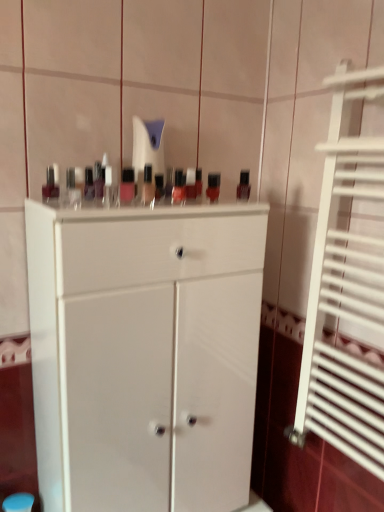
The image size is (384, 512). What do you see at coordinates (347, 283) in the screenshot?
I see `white metal radiator at right` at bounding box center [347, 283].

Find the location of a particular element. This screenshot has width=384, height=512. white metal radiator at right is located at coordinates (347, 283).

Find the location of `matte black nail polish at upper center, placed as the 3th mouthwash when sorted from front to back`. matte black nail polish at upper center, placed as the 3th mouthwash when sorted from front to back is located at coordinates (244, 185).

What is the approximate height of matte black nail polish at upper center, placed as the 3th mouthwash when sorted from front to back?

matte black nail polish at upper center, placed as the 3th mouthwash when sorted from front to back, is 4.04 inches tall.

Locate an element on the screen. Image resolution: width=384 pixels, height=512 pixels. matte black nail polish at upper left, arranged as the 2th toiletry when viewed from the front is located at coordinates (100, 176).

Would you say matte plastic mouthwash at center, arranged as the 2th mouthwash when viewed from the back, is part of matte plastic nail polish bottles at center, the 1th toiletry positioned from the front,'s contents?

Definitely not — matte plastic mouthwash at center, arranged as the 2th mouthwash when viewed from the back, is not inside matte plastic nail polish bottles at center, the 1th toiletry positioned from the front.

From a real-world perspective, which object stands above the other?

matte plastic nail polish bottles at center, the 1th toiletry positioned from the front, is physically above.

Does matte plastic nail polish bottles at center, the second toiletry viewed from the back, have a lesser height compared to matte plastic mouthwash at center, marked as the 2th mouthwash in a front-to-back arrangement?

Yes, matte plastic nail polish bottles at center, the second toiletry viewed from the back, is shorter than matte plastic mouthwash at center, marked as the 2th mouthwash in a front-to-back arrangement.

Considering the positions of objects matte black nail polish at upper center, which appears as the first mouthwash when viewed from the back, and white matte cabinet at center in the image provided, who is more to the right, matte black nail polish at upper center, which appears as the first mouthwash when viewed from the back, or white matte cabinet at center?

matte black nail polish at upper center, which appears as the first mouthwash when viewed from the back.

Is point (244, 174) farther from viewer compared to point (227, 351)?

Yes, it is.

Considering the sizes of objects matte black nail polish at upper center, placed as the 3th mouthwash when sorted from front to back, and white matte cabinet at center in the image provided, who is smaller, matte black nail polish at upper center, placed as the 3th mouthwash when sorted from front to back, or white matte cabinet at center?

With smaller size is matte black nail polish at upper center, placed as the 3th mouthwash when sorted from front to back.

From the image's perspective, does matte black nail polish at upper center, placed as the 3th mouthwash when sorted from front to back, appear higher than white matte cabinet at center?

Indeed, from the image's perspective, matte black nail polish at upper center, placed as the 3th mouthwash when sorted from front to back, is shown above white matte cabinet at center.

Is matte black bottle at left, the third mouthwash when ordered from right to left, located within white matte cabinet at center?

No, matte black bottle at left, the third mouthwash when ordered from right to left, is located outside of white matte cabinet at center.

In the image, is white matte cabinet at center on the left side or the right side of matte black bottle at left, the third mouthwash when ordered from right to left?

From the image, it's evident that white matte cabinet at center is to the right of matte black bottle at left, the third mouthwash when ordered from right to left.

From the image's perspective, is white matte cabinet at center below matte black bottle at left, marked as the first mouthwash in a left-to-right arrangement?

Yes.

Is white matte cabinet at center facing away from matte black bottle at left, which is the 3th mouthwash from back to front?

No, white matte cabinet at center is not facing the opposite direction of matte black bottle at left, which is the 3th mouthwash from back to front.

The height and width of the screenshot is (512, 384). What are the coordinates of `shutter located in front of the matte black nail polish at upper center, marked as the first mouthwash in a right-to-left arrangement` in the screenshot? It's located at (347, 283).

Does matte black nail polish at upper center, placed as the 3th mouthwash when sorted from front to back, have a lesser width compared to white metal radiator at right?

Correct, the width of matte black nail polish at upper center, placed as the 3th mouthwash when sorted from front to back, is less than that of white metal radiator at right.

Is matte black nail polish at upper center, marked as the first mouthwash in a right-to-left arrangement, positioned with its back to white metal radiator at right?

That's not correct — matte black nail polish at upper center, marked as the first mouthwash in a right-to-left arrangement, is not looking away from white metal radiator at right.

From a real-world perspective, count 2nd mouthwashs upward from the matte plastic mouthwash at center, which is counted as the second mouthwash, starting from the right, and point to it. Please provide its 2D coordinates.

[(51, 183)]

Is matte plastic mouthwash at center, arranged as the 2th mouthwash when viewed from the back, oriented away from matte black bottle at left, which is the 3th mouthwash from back to front?

matte plastic mouthwash at center, arranged as the 2th mouthwash when viewed from the back, does not have its back to matte black bottle at left, which is the 3th mouthwash from back to front.

Could matte black bottle at left, marked as the first mouthwash in a left-to-right arrangement, be considered to be inside matte plastic mouthwash at center, the second mouthwash when ordered from left to right?

No, matte black bottle at left, marked as the first mouthwash in a left-to-right arrangement, is not surrounded by matte plastic mouthwash at center, the second mouthwash when ordered from left to right.

Are matte plastic mouthwash at center, marked as the 2th mouthwash in a front-to-back arrangement, and matte black bottle at left, which is the 1th mouthwash in front-to-back order, beside each other?

matte plastic mouthwash at center, marked as the 2th mouthwash in a front-to-back arrangement, is not next to matte black bottle at left, which is the 1th mouthwash in front-to-back order, and they're not touching.

From a real-world perspective, between matte black nail polish at upper center, marked as the first mouthwash in a right-to-left arrangement, and matte black bottle at left, the third mouthwash when ordered from right to left, who is vertically lower?

matte black nail polish at upper center, marked as the first mouthwash in a right-to-left arrangement, is physically lower.

From a real-world perspective, count 1st mouthwashs downward from the matte black bottle at left, which is the 3th mouthwash from back to front, and point to it. Please provide its 2D coordinates.

[(244, 185)]

Considering the relative sizes of matte black nail polish at upper center, which appears as the first mouthwash when viewed from the back, and matte black bottle at left, which is the 1th mouthwash in front-to-back order, in the image provided, is matte black nail polish at upper center, which appears as the first mouthwash when viewed from the back, thinner than matte black bottle at left, which is the 1th mouthwash in front-to-back order,?

Indeed, matte black nail polish at upper center, which appears as the first mouthwash when viewed from the back, has a lesser width compared to matte black bottle at left, which is the 1th mouthwash in front-to-back order.

In the scene shown: Is matte black nail polish at upper left, arranged as the 1th toiletry when viewed from the back, positioned behind matte plastic nail polish bottles at center, the 1th toiletry positioned from the front?

Yes, matte black nail polish at upper left, arranged as the 1th toiletry when viewed from the back, is further from the camera.

Is point (100, 177) positioned after point (69, 172)?

That is False.

Is matte black nail polish at upper left, arranged as the 1th toiletry when viewed from the back, facing towards matte plastic nail polish bottles at center, the 1th toiletry positioned from the front?

No, matte black nail polish at upper left, arranged as the 1th toiletry when viewed from the back, does not turn towards matte plastic nail polish bottles at center, the 1th toiletry positioned from the front.

Is matte black nail polish at upper left, arranged as the 1th toiletry when viewed from the back, surrounding matte plastic nail polish bottles at center, the 1th toiletry positioned from the front?

No, matte plastic nail polish bottles at center, the 1th toiletry positioned from the front, is not a part of matte black nail polish at upper left, arranged as the 1th toiletry when viewed from the back.

The height and width of the screenshot is (512, 384). I want to click on mouthwash that is the 3rd object directly below the matte plastic nail polish bottles at center, the second toiletry viewed from the back (from a real-world perspective), so pyautogui.click(x=148, y=185).

Where is `mouthwash that is the 2nd object above the white matte cabinet at center (from a real-world perspective)`? mouthwash that is the 2nd object above the white matte cabinet at center (from a real-world perspective) is located at coordinates (244, 185).

Based on their spatial positions, is white matte cabinet at center or white metal radiator at right closer to matte black nail polish at upper center, placed as the 3th mouthwash when sorted from front to back?

white metal radiator at right lies closer to matte black nail polish at upper center, placed as the 3th mouthwash when sorted from front to back, than the other object.

Estimate the real-world distances between objects in this image. Which object is closer to white matte cabinet at center, matte black bottle at left, which is the 3th mouthwash from back to front, or white metal radiator at right?

white metal radiator at right.

When comparing their distances from white matte cabinet at center, does matte black nail polish at upper center, which appears as the first mouthwash when viewed from the back, or matte black bottle at left, which is the 3th mouthwash from back to front, seem further?

Based on the image, matte black nail polish at upper center, which appears as the first mouthwash when viewed from the back, appears to be further to white matte cabinet at center.

Looking at the image, which one is located further to matte plastic mouthwash at center, which is counted as the second mouthwash, starting from the right, white metal radiator at right or matte black nail polish at upper left, arranged as the 1th toiletry when viewed from the back?

Among the two, white metal radiator at right is located further to matte plastic mouthwash at center, which is counted as the second mouthwash, starting from the right.

Considering their positions, is white metal radiator at right positioned closer to matte black nail polish at upper center, which appears as the first mouthwash when viewed from the back, than matte plastic mouthwash at center, which is counted as the second mouthwash, starting from the right?

matte plastic mouthwash at center, which is counted as the second mouthwash, starting from the right, is positioned closer to the anchor matte black nail polish at upper center, which appears as the first mouthwash when viewed from the back.

Looking at the image, which one is located further to white matte cabinet at center, white metal radiator at right or matte black nail polish at upper center, placed as the 3th mouthwash when sorted from front to back?

The object further to white matte cabinet at center is matte black nail polish at upper center, placed as the 3th mouthwash when sorted from front to back.

When comparing their distances from matte black nail polish at upper left, arranged as the 2th toiletry when viewed from the front, does white matte cabinet at center or matte plastic nail polish bottles at center, the 1th toiletry positioned from the front, seem closer?

matte plastic nail polish bottles at center, the 1th toiletry positioned from the front, is closer to matte black nail polish at upper left, arranged as the 2th toiletry when viewed from the front.

Based on their spatial positions, is matte plastic mouthwash at center, which is counted as the second mouthwash, starting from the right, or matte black nail polish at upper left, arranged as the 1th toiletry when viewed from the back, further from white metal radiator at right?

Based on the image, matte black nail polish at upper left, arranged as the 1th toiletry when viewed from the back, appears to be further to white metal radiator at right.

The image size is (384, 512). Find the location of `mouthwash located between matte black bottle at left, the third mouthwash when ordered from right to left, and matte black nail polish at upper center, which is counted as the third mouthwash, starting from the left, in the left-right direction`. mouthwash located between matte black bottle at left, the third mouthwash when ordered from right to left, and matte black nail polish at upper center, which is counted as the third mouthwash, starting from the left, in the left-right direction is located at coordinates (148, 185).

Where is `toiletry between matte plastic mouthwash at center, which is counted as the second mouthwash, starting from the right, and white matte cabinet at center from top to bottom`? toiletry between matte plastic mouthwash at center, which is counted as the second mouthwash, starting from the right, and white matte cabinet at center from top to bottom is located at coordinates (74, 185).

I want to click on toiletry that lies between matte black nail polish at upper left, arranged as the 1th toiletry when viewed from the back, and white matte cabinet at center from top to bottom, so click(x=74, y=185).

The height and width of the screenshot is (512, 384). I want to click on mouthwash between matte black nail polish at upper left, arranged as the 1th toiletry when viewed from the back, and matte black nail polish at upper center, marked as the first mouthwash in a right-to-left arrangement, in the horizontal direction, so click(x=148, y=185).